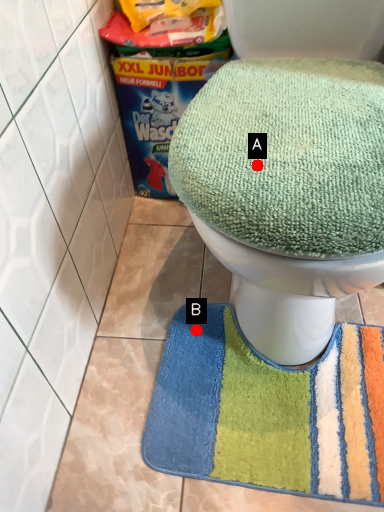
Question: Two points are circled on the image, labeled by A and B beside each circle. Which point is farther to the camera?

Choices:
 (A) A is further
 (B) B is further

Answer: (B)